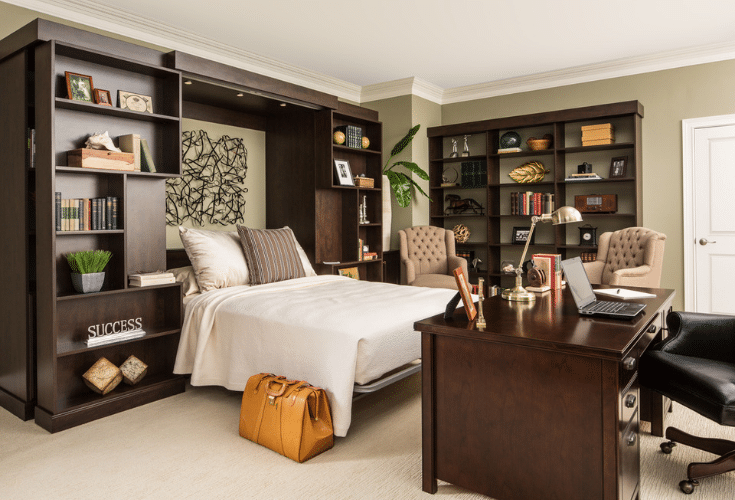
Where is `black leather wheel seat`? black leather wheel seat is located at coordinates (702, 384).